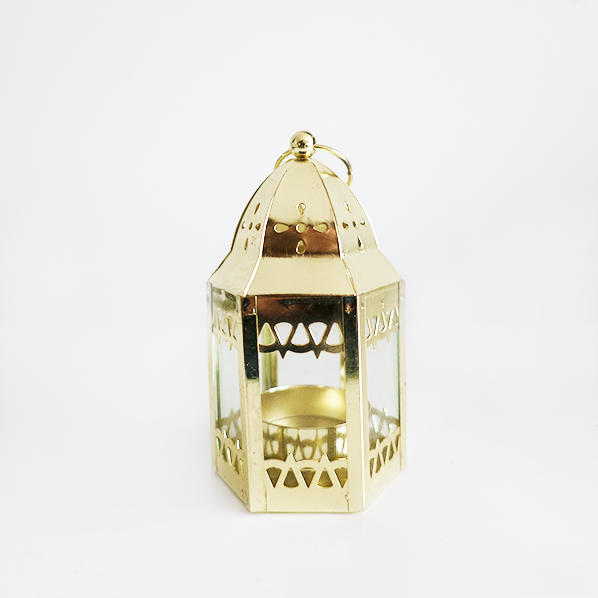
At what (x,y) coordinates should I click in order to perform the action: click on support pillar. Please return your answer as a coordinate pair (x, y). The image size is (598, 598). Looking at the image, I should click on (362, 405), (404, 384), (255, 393), (210, 383), (274, 371), (341, 365).